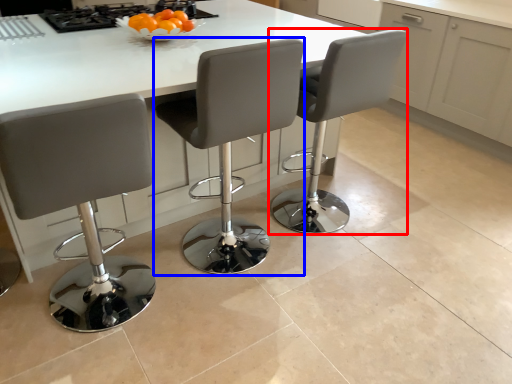
Question: Which of the following is the farthest to the observer, chair (highlighted by a red box) or chair (highlighted by a blue box)?

Choices:
 (A) chair
 (B) chair

Answer: (A)